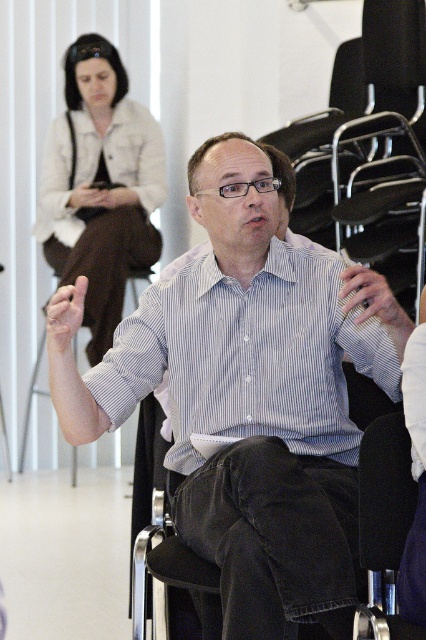
Question: Can you confirm if blue striped shirt at center is thinner than matte white blouse at upper left?

Choices:
 (A) no
 (B) yes

Answer: (A)

Question: Among these points, which one is nearest to the camera?

Choices:
 (A) (62, 291)
 (B) (63, 204)
 (C) (117, 406)
 (D) (229, 401)

Answer: (A)

Question: Does blue striped shirt at center have a larger size compared to matte skin hand at center?

Choices:
 (A) no
 (B) yes

Answer: (B)

Question: Is blue striped shirt at center further to camera compared to matte skin hand at center?

Choices:
 (A) yes
 (B) no

Answer: (B)

Question: Which object appears closest to the camera in this image?

Choices:
 (A) matte skin hand at center
 (B) striped cotton shirt at center
 (C) blue striped shirt at center

Answer: (C)

Question: Among these points, which one is farthest from the camera?

Choices:
 (A) (316, 371)
 (B) (132, 264)

Answer: (B)